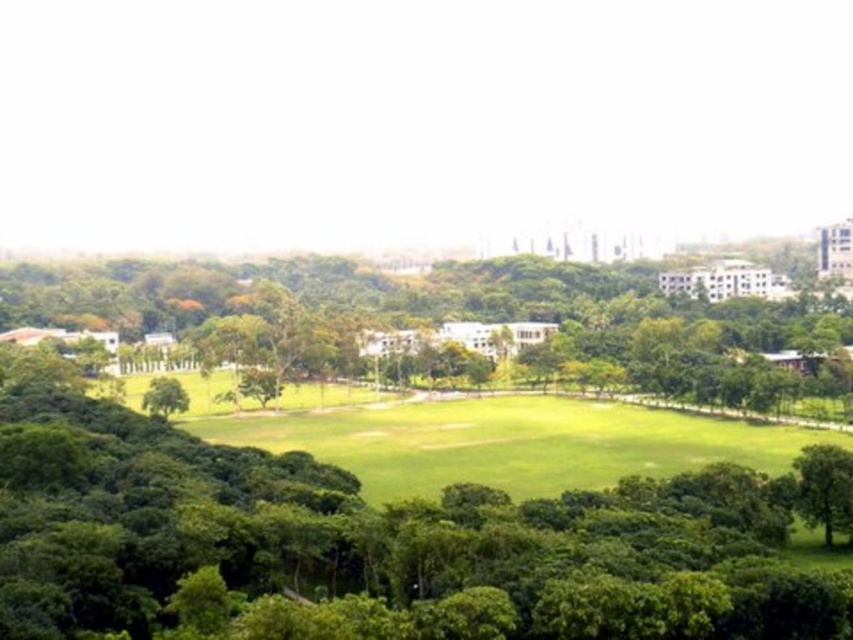
You are planning to set up a picnic blanket in the green grassy field at center. Considering the presence of the green leafy tree at center, will there be enough space for the blanket without it being under the tree?

The green leafy tree at center is taller than the green grassy field at center, but since both are at the center, the tree may cast shade over part of the field. However, the question is about space for the blanket. Since the field is open and the tree is at the same central location, you can place the blanket around the base of the tree where there is sufficient grassy area not obstructed by the tree itself.

You are standing at the center of the grassy field and want to walk to both the green leafy tree at lower right and the green leafy tree at lower left. Which tree is farther away from your current position?

The green leafy tree at lower right is farther away from your current position since it is 515.47 feet away from the green leafy tree at lower left, implying that the distance from the center to the right tree is greater than to the left one.

You are standing at the center of the grassy field and want to head towards the green leafy tree at lower right. Which direction should you walk to reach it?

The green leafy tree at lower right is located at point 0.764 on the x and 0.967 on the y, so you should walk towards the lower right direction to reach it.